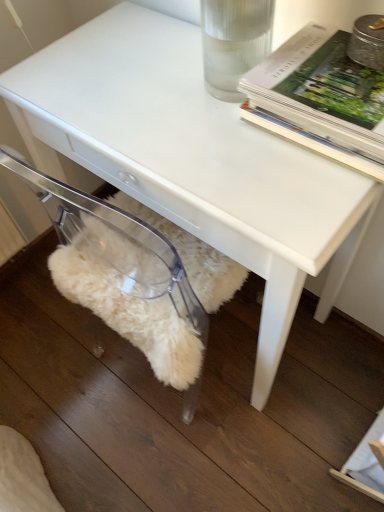
The image size is (384, 512). What are the coordinates of `vacant area that is in front of transparent acrylic swivel chair at lower left` in the screenshot? It's located at (195, 456).